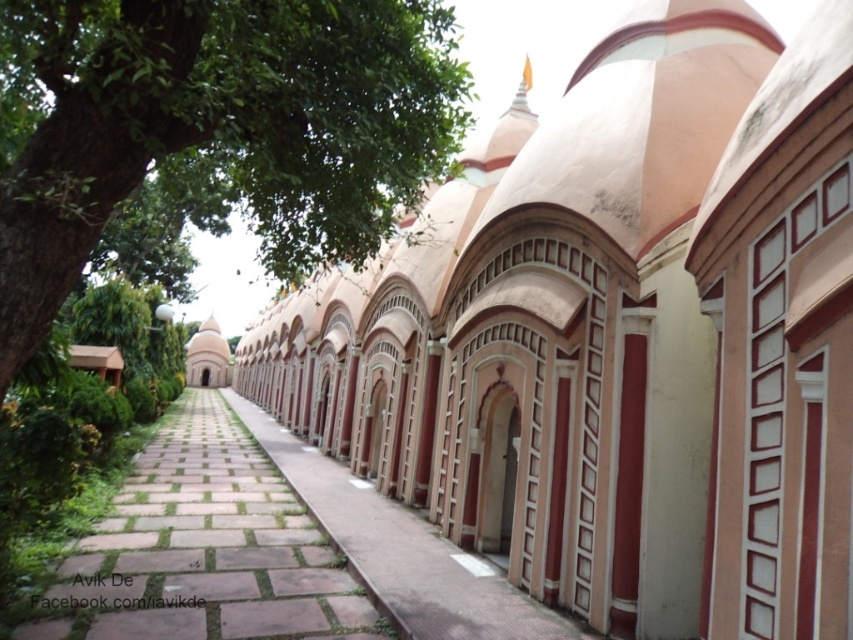
You are standing at the entrance of the corridor and want to take a photo of the pink stone pathway at center without the green leafy tree at upper left blocking the view. Which direction should you move to achieve this?

Move to the right side of the corridor so that the green leafy tree at upper left is no longer blocking the view of the pink stone pathway at center.

You are a tour guide leading a group through the corridor. You want to ensure that a 3.5 meter long banner can be displayed between the pink stone archway at center and the brown stone path at center without touching either. Is this possible?

The pink stone archway at center and brown stone path at center are 4.03 meters apart. Since the banner is 3.5 meters long, which is shorter than the distance between them, it can be displayed between them without touching either.